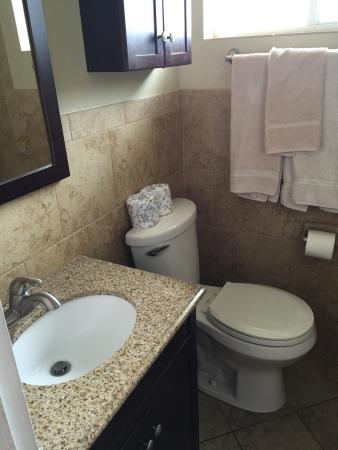
Locate an element on the screen. cabinet is located at coordinates (120, 48).